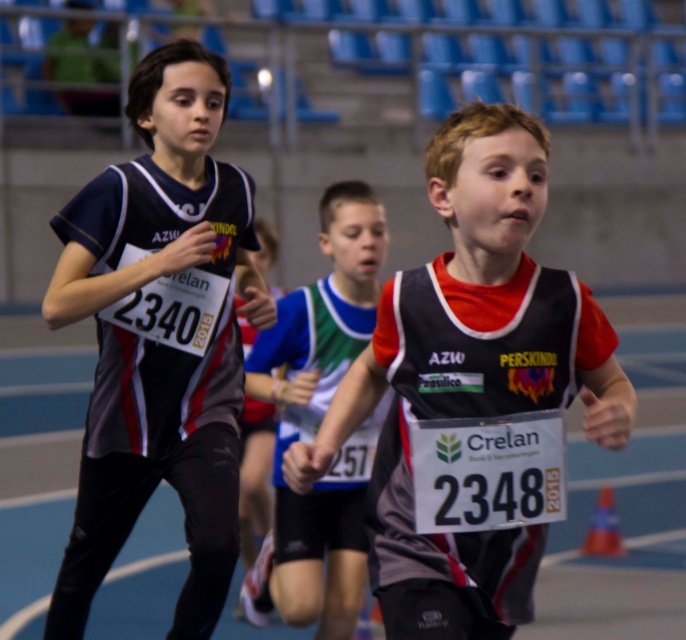
You are a photographer standing at the starting line of the race. You want to take a photo that includes both point (584, 317) and point (322, 316). Which point will appear larger in your photo?

→ Point (584, 317) is closer to the viewer, so it will appear larger in the photo than point (322, 316).

You are a photographer at a track event and want to capture a photo of the matte black jersey at center and the matte black vest at center. Which object is narrower when viewed from the front?

The matte black jersey at center has a lesser width compared to the matte black vest at center, so the matte black jersey at center is narrower when viewed from the front.

You are a photographer at the event and need to capture a clear shot of both the matte black jersey at center and the white fabric shirt at center. Based on their positions, which jersey is closer to the camera?

The matte black jersey at center is closer to the camera since it is located above the white fabric shirt at center, indicating it is in front.